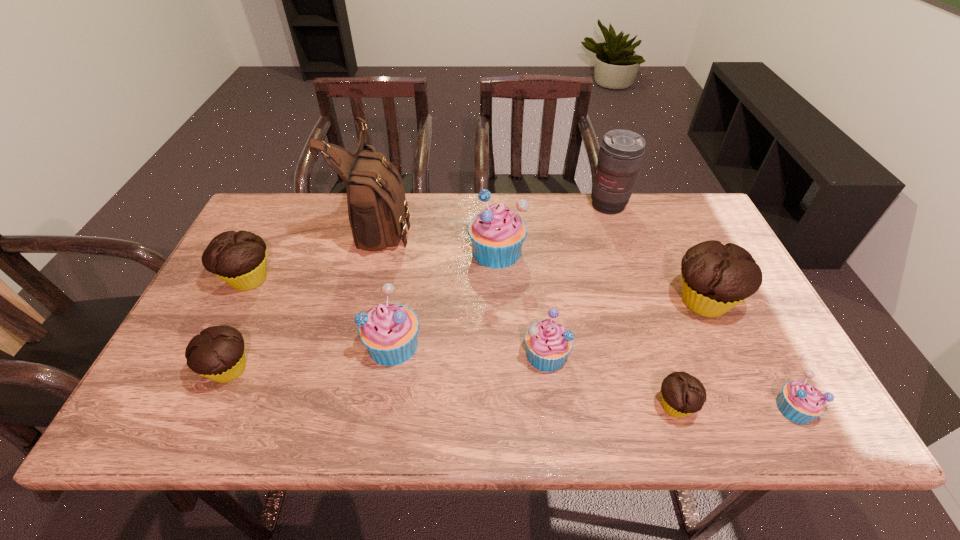
Where is `the rightmost blue muffin`? the rightmost blue muffin is located at coordinates (800, 402).

This screenshot has width=960, height=540. I want to click on the nearest blue muffin, so click(x=800, y=402).

The width and height of the screenshot is (960, 540). Find the location of `the third chocolate muffin from left to right`. the third chocolate muffin from left to right is located at coordinates [x=682, y=394].

The width and height of the screenshot is (960, 540). What are the coordinates of `the third muffin from right to left` in the screenshot? It's located at (682, 394).

You are a GUI agent. You are given a task and a screenshot of the screen. Output one action in this format:
    pyautogui.click(x=<x>, y=<y>)
    Task: Click on the vacant space located on the front-facing side of the brown shoulder bag
    The height and width of the screenshot is (540, 960).
    Given the screenshot: What is the action you would take?
    click(506, 224)

You are a GUI agent. You are given a task and a screenshot of the screen. Output one action in this format:
    pyautogui.click(x=<x>, y=<y>)
    Task: Click on the blank area located 0.070m on the side of the telephoto lens where the control switches are located
    
    Given the screenshot: What is the action you would take?
    pyautogui.click(x=617, y=232)

You are a GUI agent. You are given a task and a screenshot of the screen. Output one action in this format:
    pyautogui.click(x=<x>, y=<y>)
    Task: Click on the free point located 0.310m on the front of the biggest blue muffin
    Image resolution: width=960 pixels, height=540 pixels.
    Given the screenshot: What is the action you would take?
    pyautogui.click(x=501, y=368)

The height and width of the screenshot is (540, 960). What are the coordinates of `vacant area situated 0.290m on the left of the biggest chocolate muffin` in the screenshot? It's located at (557, 302).

Where is `vacant space situated on the back of the third smallest blue muffin`? The width and height of the screenshot is (960, 540). vacant space situated on the back of the third smallest blue muffin is located at coordinates (410, 240).

The image size is (960, 540). I want to click on vacant space situated 0.230m on the back of the second biggest chocolate muffin, so click(x=283, y=211).